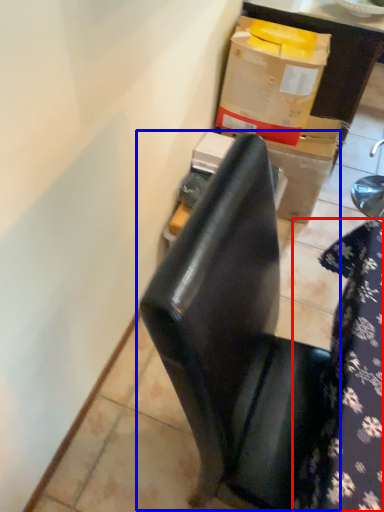
Question: Which of the following is the farthest to the observer, tablecloth (highlighted by a red box) or chair (highlighted by a blue box)?

Choices:
 (A) tablecloth
 (B) chair

Answer: (A)